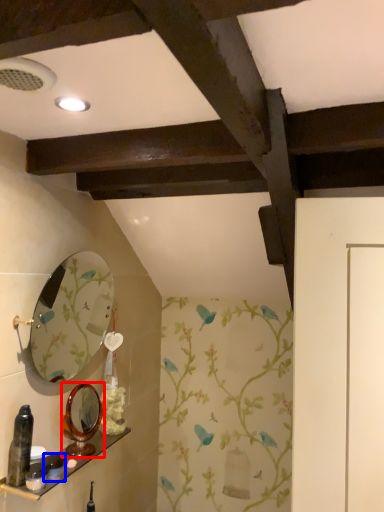
Question: Which object appears farthest to the camera in this image, mirror (highlighted by a red box) or toiletry (highlighted by a blue box)?

Choices:
 (A) mirror
 (B) toiletry

Answer: (A)